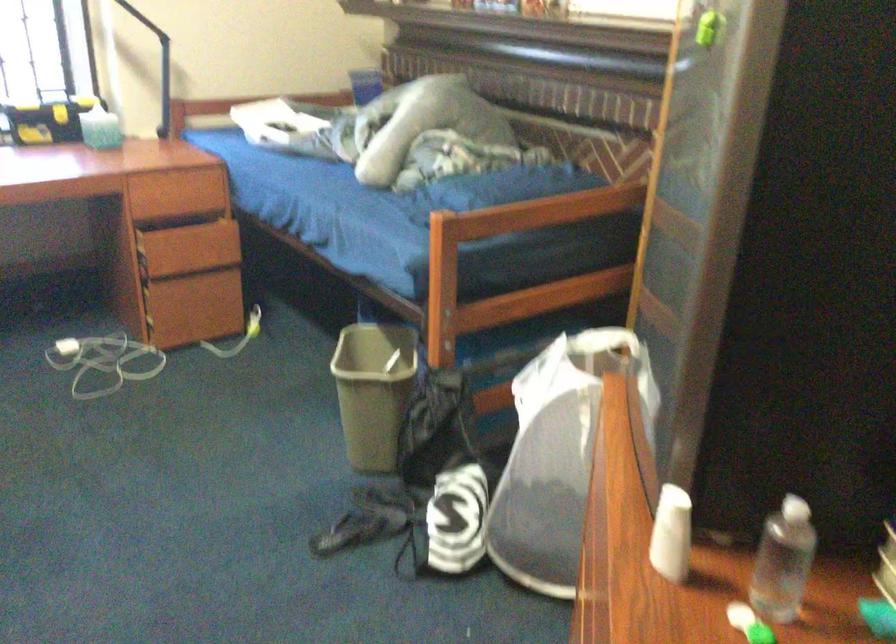
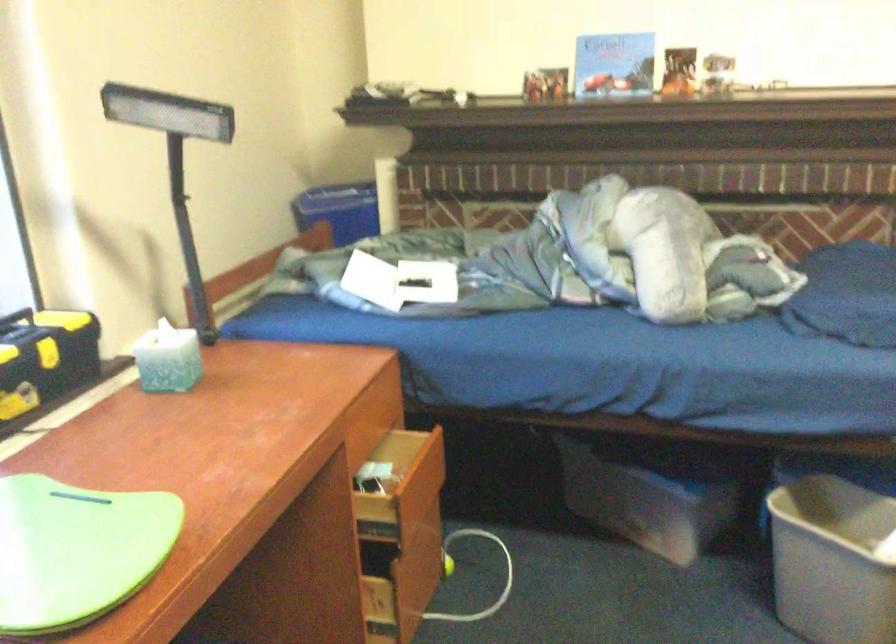
The point at (x=199, y=248) is marked in the first image. Where is the corresponding point in the second image?

(419, 489)